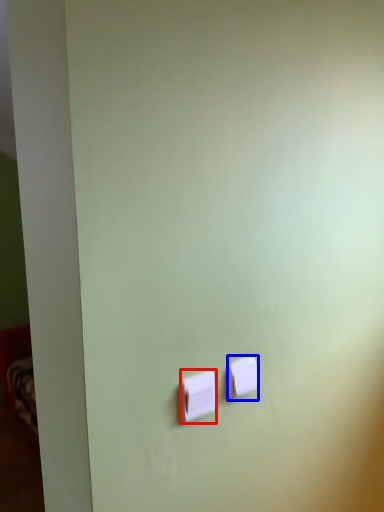
Question: Which point is closer to the camera, light switch (highlighted by a red box) or light switch (highlighted by a blue box)?

Choices:
 (A) light switch
 (B) light switch

Answer: (A)